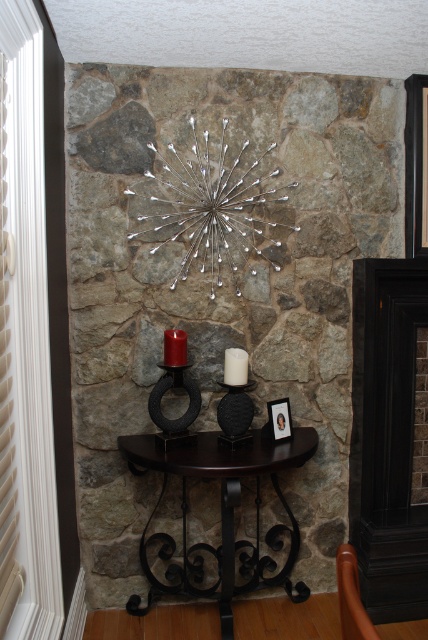
You are standing in the room and want to place a decorative item on the console table below the metal piece. The console table is at point 0.684, 0.904. Can you confirm if the black matte fireplace at right is the correct location for placing the item?

The black matte fireplace at right is located at point (386,436), so yes, placing the decorative item there would be correct as it aligns with the console table below the metal piece.

You are a guest in the room and want to light a candle. You see the black matte fireplace at right and the black matte candle holder at center. Which object should you use to light the candle?

The black matte candle holder at center is the correct object to light the candle since candle holders are designed for holding candles, while the fireplace is meant for burning fires. Additionally, according to the description, the black matte fireplace at right is located below the candle holder, which might indicate their placement but doesn t change their intended use.